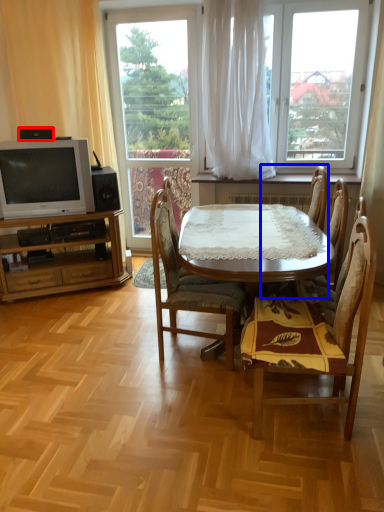
Question: Which of the following is the farthest to the observer, loudspeaker (highlighted by a red box) or chair (highlighted by a blue box)?

Choices:
 (A) loudspeaker
 (B) chair

Answer: (A)